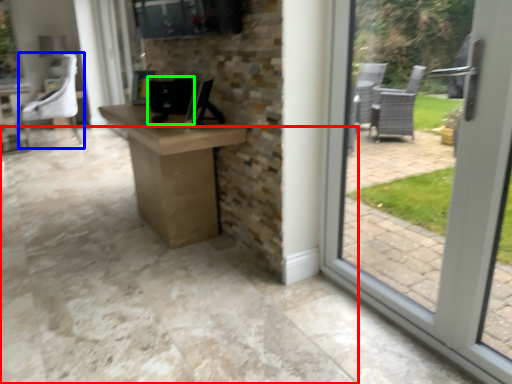
Question: Considering the real-world distances, which object is farthest from concrete (highlighted by a red box)? chair (highlighted by a blue box) or desktop computer (highlighted by a green box)?

Choices:
 (A) chair
 (B) desktop computer

Answer: (A)